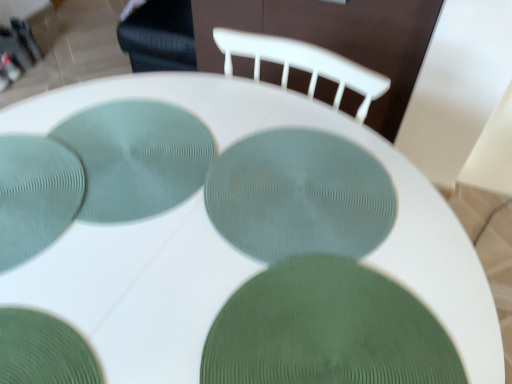
Question: Does point (315, 230) appear closer or farther from the camera than point (38, 359)?

Choices:
 (A) farther
 (B) closer

Answer: (A)

Question: From the image's perspective, is matte green plate at center, acting as the fourth glass plate starting from the left, positioned above or below green textured glass plate at lower left, which ranks as the second glass plate in left-to-right order?

Choices:
 (A) below
 (B) above

Answer: (B)

Question: Based on their relative distances, which object is nearer to the green textured plate at center, marked as the 1th glass plate in a right-to-left arrangement?

Choices:
 (A) matte green plate at lower left, which is the first glass plate in left-to-right order
 (B) matte green plate at center, acting as the fourth glass plate starting from the left
 (C) teal textured placemat at center, the third glass plate viewed from the left
 (D) green textured glass plate at lower left, which ranks as the second glass plate in left-to-right order

Answer: (B)

Question: Which is nearer to the green textured plate at center, marked as the 1th glass plate in a right-to-left arrangement?

Choices:
 (A) teal textured placemat at center, the third glass plate viewed from the left
 (B) matte green plate at center, placed as the second glass plate when sorted from right to left
 (C) matte green plate at lower left, marked as the 5th glass plate in a right-to-left arrangement
 (D) green textured glass plate at lower left, the fourth glass plate viewed from the right

Answer: (B)